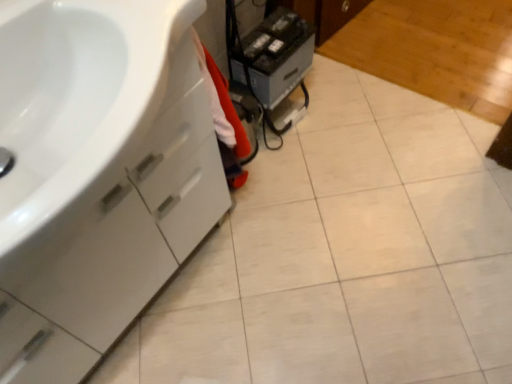
Question: Considering the relative sizes of white glossy cabinet at left and black plastic printer at center in the image provided, is white glossy cabinet at left shorter than black plastic printer at center?

Choices:
 (A) yes
 (B) no

Answer: (B)

Question: Is the position of white glossy cabinet at left more distant than that of black plastic printer at center?

Choices:
 (A) no
 (B) yes

Answer: (A)

Question: Does white glossy cabinet at left appear on the right side of black plastic printer at center?

Choices:
 (A) no
 (B) yes

Answer: (A)

Question: From a real-world perspective, does white glossy cabinet at left stand above black plastic printer at center?

Choices:
 (A) yes
 (B) no

Answer: (A)

Question: Can you confirm if white glossy cabinet at left is bigger than black plastic printer at center?

Choices:
 (A) yes
 (B) no

Answer: (A)

Question: Does white glossy cabinet at left have a lesser width compared to black plastic printer at center?

Choices:
 (A) yes
 (B) no

Answer: (B)

Question: Can you confirm if black plastic printer at center is smaller than white glossy cabinet at left?

Choices:
 (A) no
 (B) yes

Answer: (B)

Question: From a real-world perspective, does black plastic printer at center sit lower than white glossy cabinet at left?

Choices:
 (A) yes
 (B) no

Answer: (A)

Question: From a real-world perspective, does black plastic printer at center stand above white glossy cabinet at left?

Choices:
 (A) yes
 (B) no

Answer: (B)

Question: Can you confirm if black plastic printer at center is positioned to the right of white glossy cabinet at left?

Choices:
 (A) no
 (B) yes

Answer: (B)

Question: From the image's perspective, would you say black plastic printer at center is shown under white glossy cabinet at left?

Choices:
 (A) yes
 (B) no

Answer: (B)

Question: Is black plastic printer at center further to camera compared to white glossy cabinet at left?

Choices:
 (A) yes
 (B) no

Answer: (A)

Question: From the image's perspective, is white glossy cabinet at left above or below black plastic printer at center?

Choices:
 (A) above
 (B) below

Answer: (B)